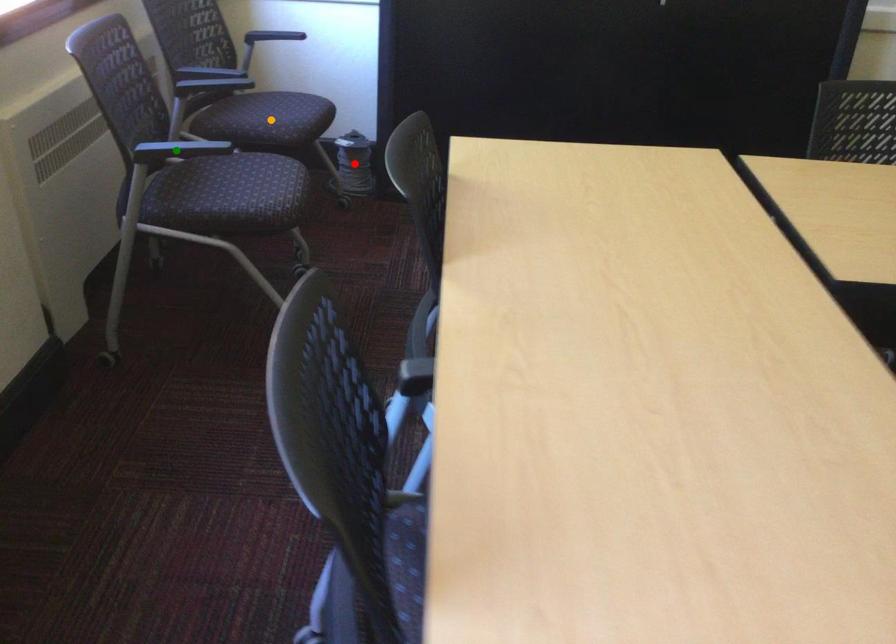
Order these from nearest to farthest:
red point, orange point, green point

1. green point
2. orange point
3. red point